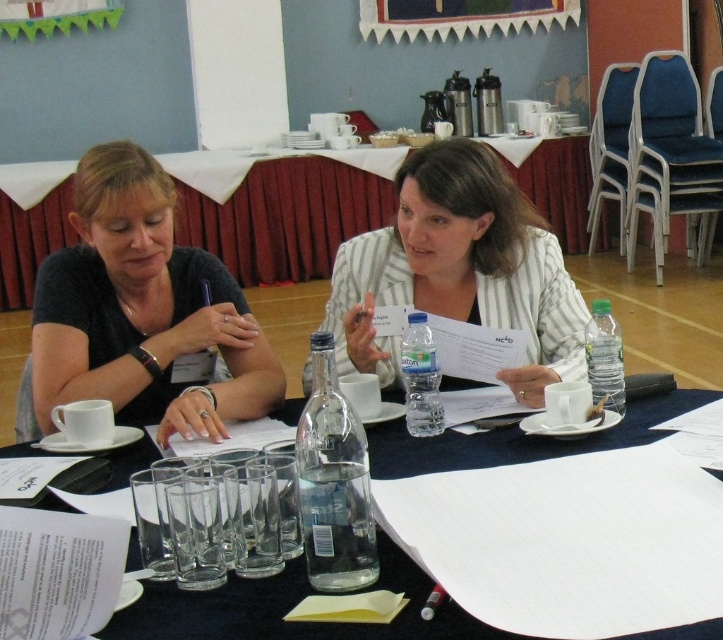
Looking at this image, is clear plastic glasses at lower left bigger than wooden bulletin board at upper center?

Incorrect, clear plastic glasses at lower left is not larger than wooden bulletin board at upper center.

This screenshot has height=640, width=723. What do you see at coordinates (288, 609) in the screenshot? I see `clear plastic glasses at lower left` at bounding box center [288, 609].

Where is `clear plastic glasses at lower left`? clear plastic glasses at lower left is located at coordinates (288, 609).

Does matte black shirt at left appear on the left side of white paper at center?

In fact, matte black shirt at left is to the right of white paper at center.

Who is taller, matte black shirt at left or white paper at center?

With more height is white paper at center.

Is point (127, 180) positioned behind point (328, 198)?

No, it is not.

Where is `matte black shirt at left`? The height and width of the screenshot is (640, 723). matte black shirt at left is located at coordinates (142, 310).

Does clear plastic glasses at lower left have a smaller size compared to white paper at center?

Indeed, clear plastic glasses at lower left has a smaller size compared to white paper at center.

What do you see at coordinates (288, 609) in the screenshot? I see `clear plastic glasses at lower left` at bounding box center [288, 609].

Which is in front, point (437, 614) or point (286, 193)?

Point (437, 614) is more forward.

The width and height of the screenshot is (723, 640). I want to click on clear plastic glasses at lower left, so click(288, 609).